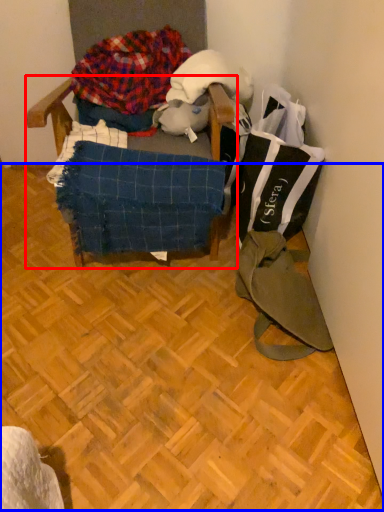
Question: Which object is closer to the camera taking this photo, furniture (highlighted by a red box) or wood (highlighted by a blue box)?

Choices:
 (A) furniture
 (B) wood

Answer: (B)